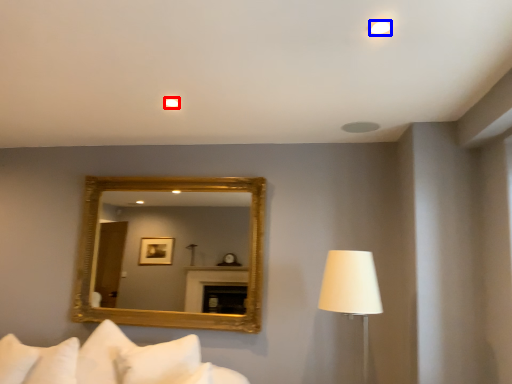
Question: Which of the following is the farthest to the observer, lighting (highlighted by a red box) or lighting (highlighted by a blue box)?

Choices:
 (A) lighting
 (B) lighting

Answer: (A)